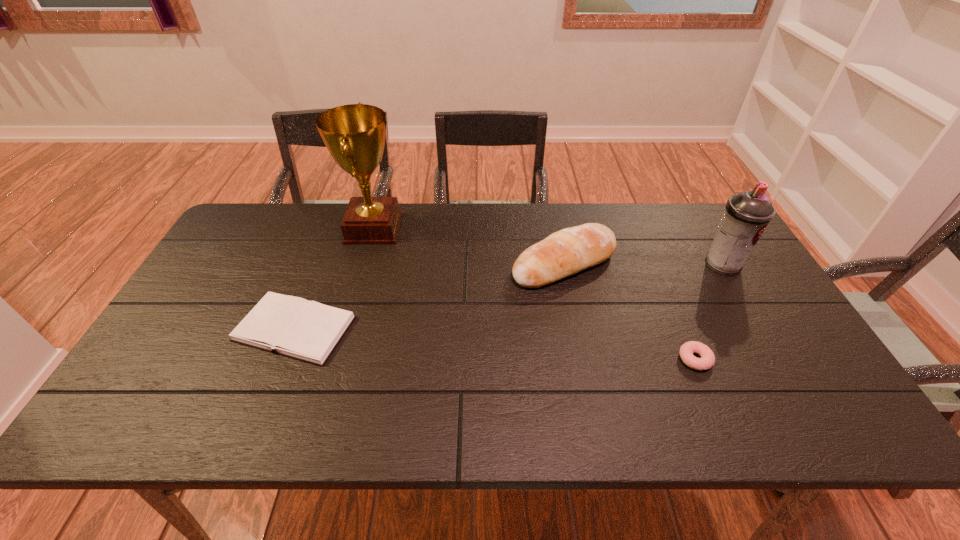
Where is `award`? This screenshot has height=540, width=960. award is located at coordinates pyautogui.click(x=354, y=134).

The width and height of the screenshot is (960, 540). I want to click on the rightmost object, so click(x=747, y=214).

This screenshot has height=540, width=960. In order to click on the fourth shortest object in this screenshot , I will do `click(747, 214)`.

Where is `the third tallest object`? The image size is (960, 540). the third tallest object is located at coordinates (563, 253).

Find the location of a particular element. The image size is (960, 540). bread is located at coordinates (563, 253).

You are a GUI agent. You are given a task and a screenshot of the screen. Output one action in this format:
    pyautogui.click(x=<x>, y=<y>)
    Task: Click on the hardback book
    The image size is (960, 540).
    Given the screenshot: What is the action you would take?
    pyautogui.click(x=309, y=331)

Where is `the fourth object from left to right`? The height and width of the screenshot is (540, 960). the fourth object from left to right is located at coordinates (707, 360).

In order to click on vacant area located on the plaque of the award in this screenshot , I will do [x=496, y=228].

The width and height of the screenshot is (960, 540). In order to click on free space located 0.260m on the left of the aerosol can in this screenshot , I will do `click(616, 265)`.

I want to click on vacant space located on the right of the third shortest object, so click(x=725, y=264).